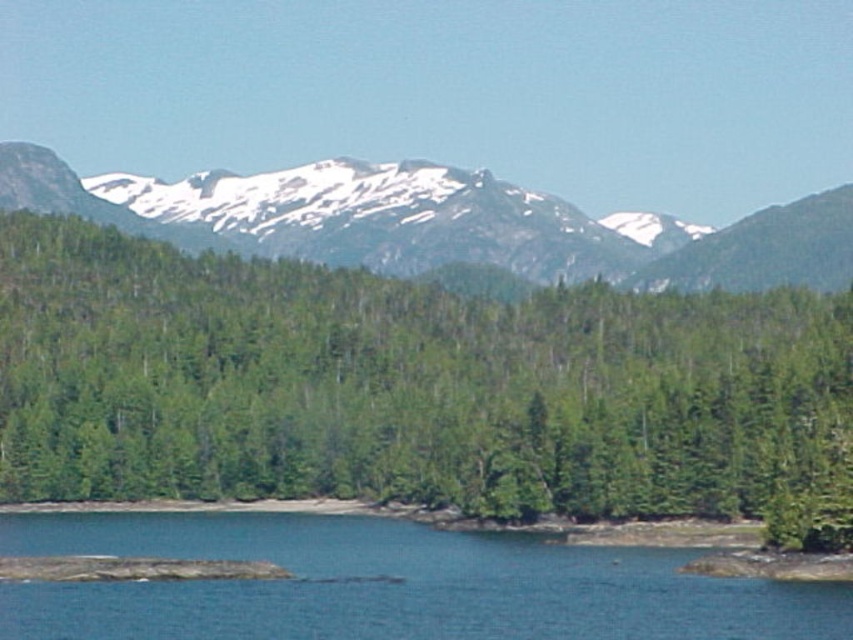
Can you confirm if green matte tree at center is positioned below blue water at lower center?

No.

Locate an element on the screen. green matte tree at center is located at coordinates (403, 387).

At what (x,y) coordinates should I click in order to perform the action: click on green matte tree at center. Please return your answer as a coordinate pair (x, y). This screenshot has width=853, height=640. Looking at the image, I should click on (403, 387).

In the scene shown: Which of these two, green matte tree at center or snowy granite mountain range at upper center, stands taller?

Standing taller between the two is green matte tree at center.

Can you confirm if green matte tree at center is bigger than snowy granite mountain range at upper center?

No, green matte tree at center is not bigger than snowy granite mountain range at upper center.

Who is more distant from viewer, (785, 403) or (335, 192)?

The point (335, 192) is more distant.

Locate an element on the screen. This screenshot has width=853, height=640. green matte tree at center is located at coordinates (403, 387).

Does blue water at lower center appear on the left side of snowy granite mountain range at upper center?

Indeed, blue water at lower center is positioned on the left side of snowy granite mountain range at upper center.

Is blue water at lower center below snowy granite mountain range at upper center?

Yes.

This screenshot has height=640, width=853. What do you see at coordinates (392, 586) in the screenshot? I see `blue water at lower center` at bounding box center [392, 586].

Locate an element on the screen. blue water at lower center is located at coordinates (392, 586).